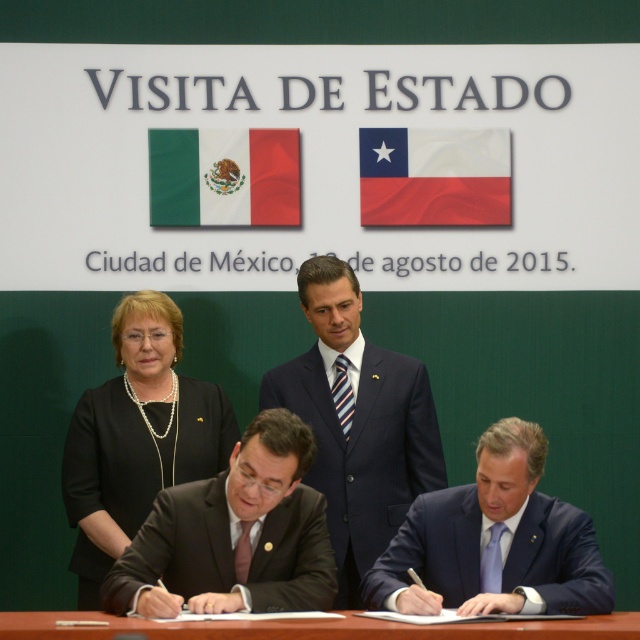
Question: Which point is farther from the camera taking this photo?

Choices:
 (A) (316, 481)
 (B) (140, 483)

Answer: (A)

Question: Which of the following is the closest to the observer?

Choices:
 (A) light blue satin business suit at lower right
 (B) red fabric chilean flag at center

Answer: (A)

Question: Does black matte suit at upper left lie behind light blue satin business suit at lower right?

Choices:
 (A) no
 (B) yes

Answer: (B)

Question: Can you confirm if green fabric flag at upper center is smaller than red fabric chilean flag at center?

Choices:
 (A) no
 (B) yes

Answer: (A)

Question: Is dark blue pinstripe suit at center further to the viewer compared to green fabric flag at upper center?

Choices:
 (A) no
 (B) yes

Answer: (A)

Question: Which point is farther to the camera?

Choices:
 (A) (205, 516)
 (B) (468, 586)
 (C) (141, 470)

Answer: (C)